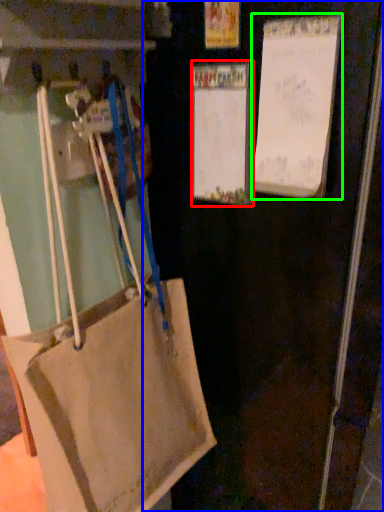
Question: Estimate the real-world distances between objects in this image. Which object is closer to bulletin board (highlighted by a red box), door (highlighted by a blue box) or bulletin board (highlighted by a green box)?

Choices:
 (A) door
 (B) bulletin board

Answer: (B)